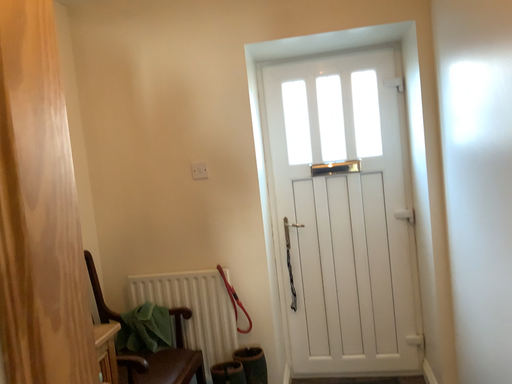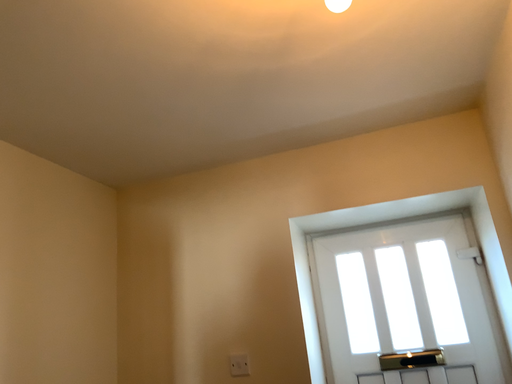
Question: How did the camera likely rotate when shooting the video?

Choices:
 (A) rotated downward
 (B) rotated upward

Answer: (B)